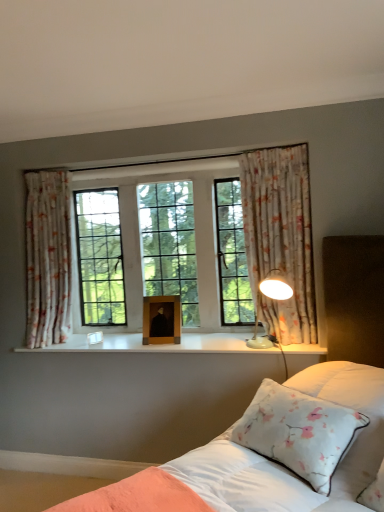
This screenshot has height=512, width=384. I want to click on empty space that is ontop of floral fabric curtain at left, placed as the first curtain when sorted from back to front (from a real-world perspective), so click(51, 168).